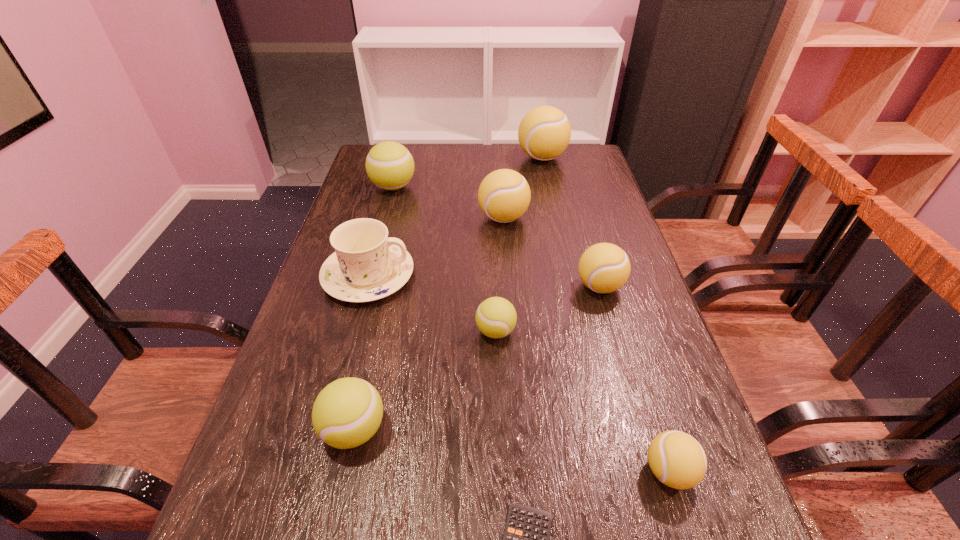
The image size is (960, 540). In order to click on free space between the biggest green tennis ball and the nearest green tennis ball in this screenshot , I will do `click(374, 308)`.

This screenshot has height=540, width=960. Identify the location of unoccupied position between the fourth farthest tennis ball and the second biggest green tennis ball. (477, 358).

At what (x,y) coordinates should I click in order to perform the action: click on free space between the fourth farthest tennis ball and the smallest green tennis ball. Please return your answer as a coordinate pair (x, y). Looking at the image, I should click on (547, 309).

Locate an element on the screen. The image size is (960, 540). empty space between the nearest yellow tennis ball and the third farthest object is located at coordinates (587, 345).

Find the location of a particular element. unoccupied position between the second biggest green tennis ball and the nearest yellow tennis ball is located at coordinates (512, 450).

Find the location of `free space that is in between the chinaware and the sixth farthest object`. free space that is in between the chinaware and the sixth farthest object is located at coordinates tap(432, 303).

Where is `vacant area that lies between the farthest green tennis ball and the second biggest green tennis ball`? The height and width of the screenshot is (540, 960). vacant area that lies between the farthest green tennis ball and the second biggest green tennis ball is located at coordinates [x=374, y=308].

Locate an element on the screen. Image resolution: width=960 pixels, height=540 pixels. vacant space that's between the nearest yellow tennis ball and the farthest tennis ball is located at coordinates (606, 314).

Choose which object is the fifth nearest neighbor to the second farthest tennis ball. Please provide its 2D coordinates. Your answer should be formatted as a tuple, i.e. [(x, y)], where the tuple contains the x and y coordinates of a point satisfying the conditions above.

[(604, 267)]

Identify which object is the third closest to the farthest green tennis ball. Please provide its 2D coordinates. Your answer should be formatted as a tuple, i.e. [(x, y)], where the tuple contains the x and y coordinates of a point satisfying the conditions above.

[(544, 133)]